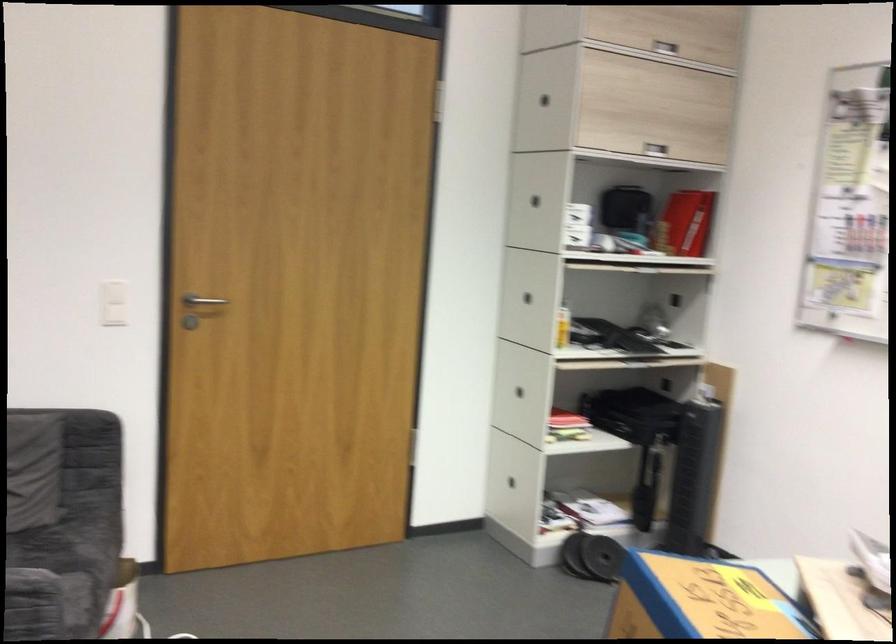
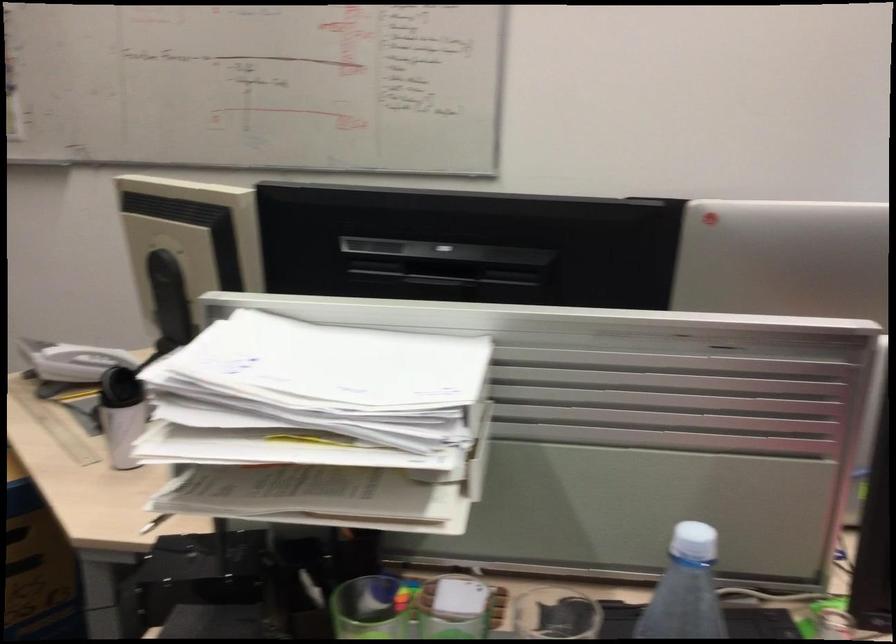
The images are taken continuously from a first-person perspective. In which direction is your viewpoint rotating?

The camera rotated toward right-down.